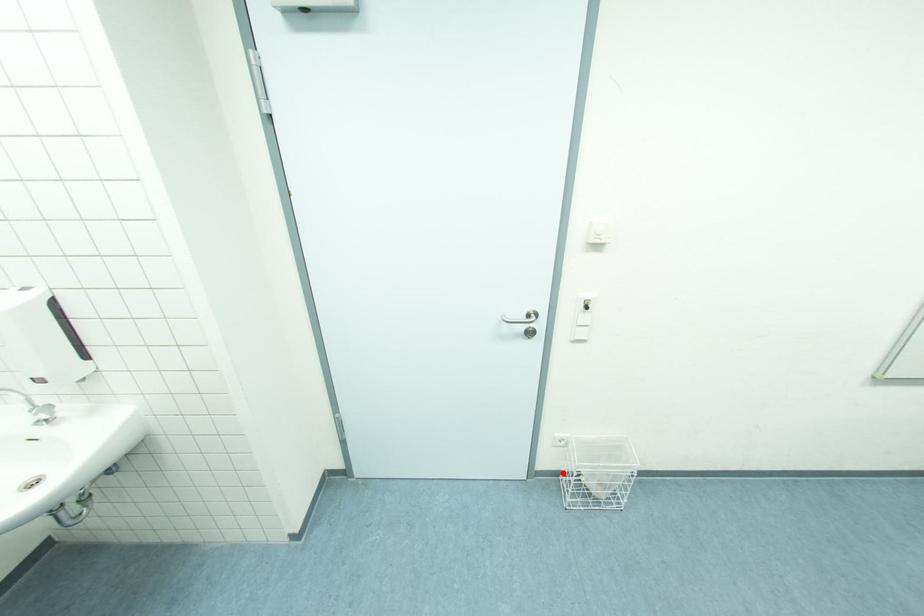
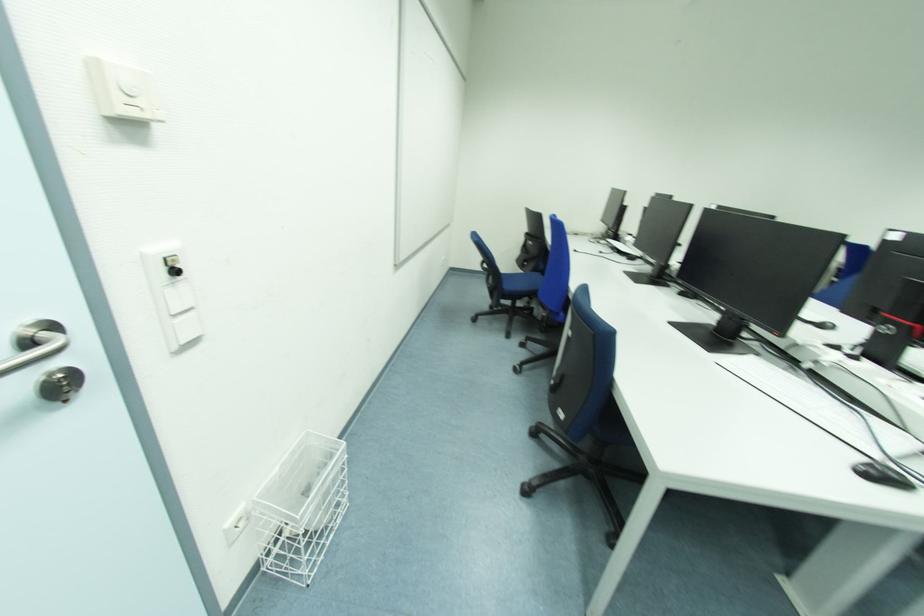
Locate, in the second image, the point that corresponds to the highlighted location in the first image.

(261, 564)